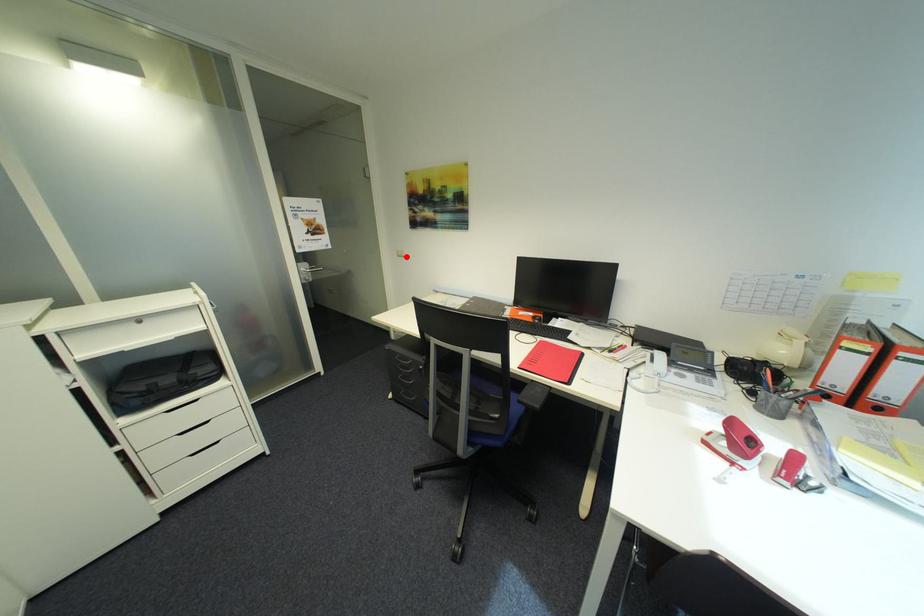
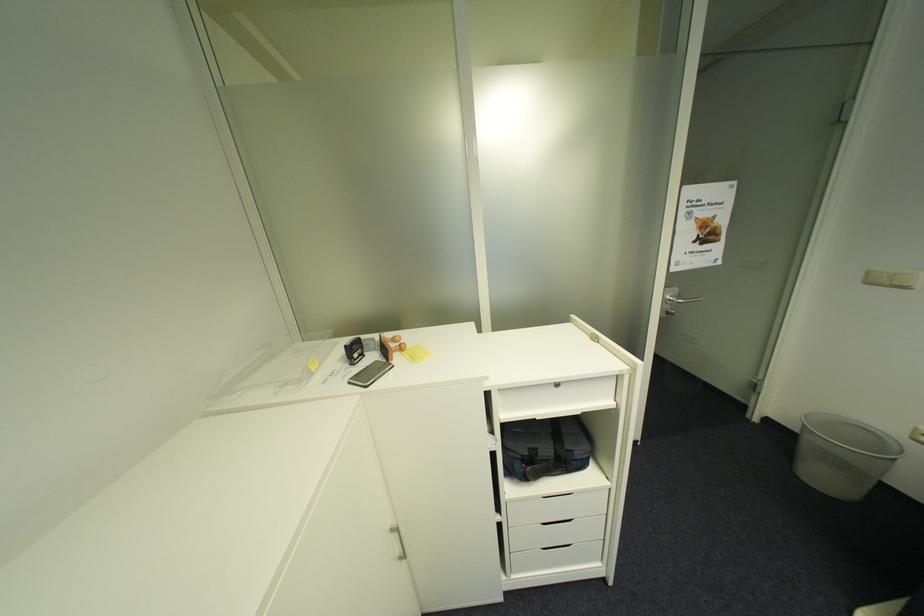
The point at the highlighted location is marked in the first image. Where is the corresponding point in the second image?

(876, 284)